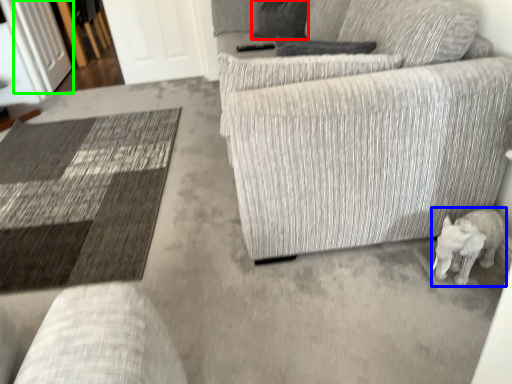
Question: Based on their relative distances, which object is farther from pillow (highlighted by a red box)? Choose from animal (highlighted by a blue box) and glass door (highlighted by a green box).

Choices:
 (A) animal
 (B) glass door

Answer: (B)